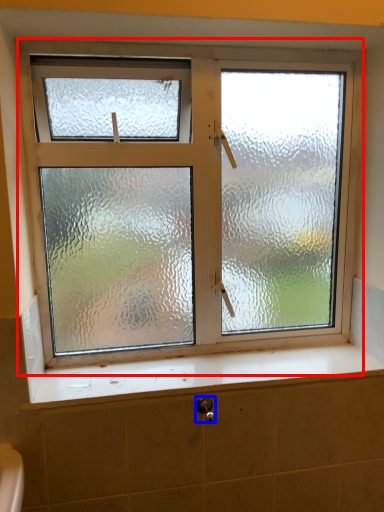
Question: Which object appears farthest to the camera in this image, window (highlighted by a red box) or shower (highlighted by a blue box)?

Choices:
 (A) window
 (B) shower

Answer: (A)